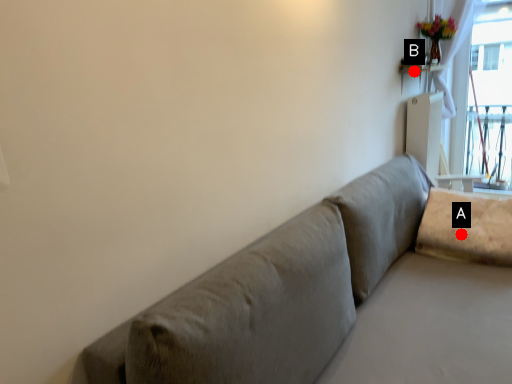
Question: Two points are circled on the image, labeled by A and B beside each circle. Which point is closer to the camera taking this photo?

Choices:
 (A) A is closer
 (B) B is closer

Answer: (A)